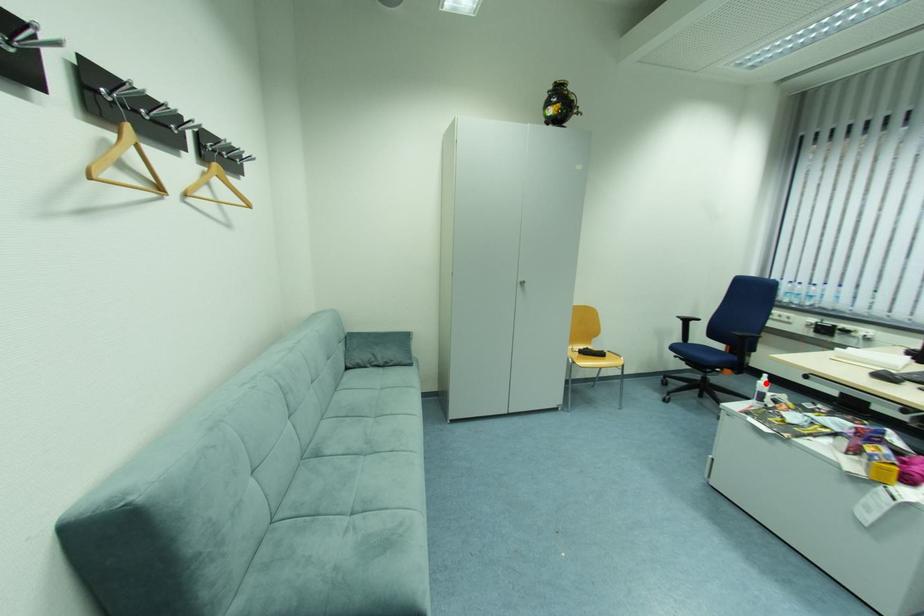
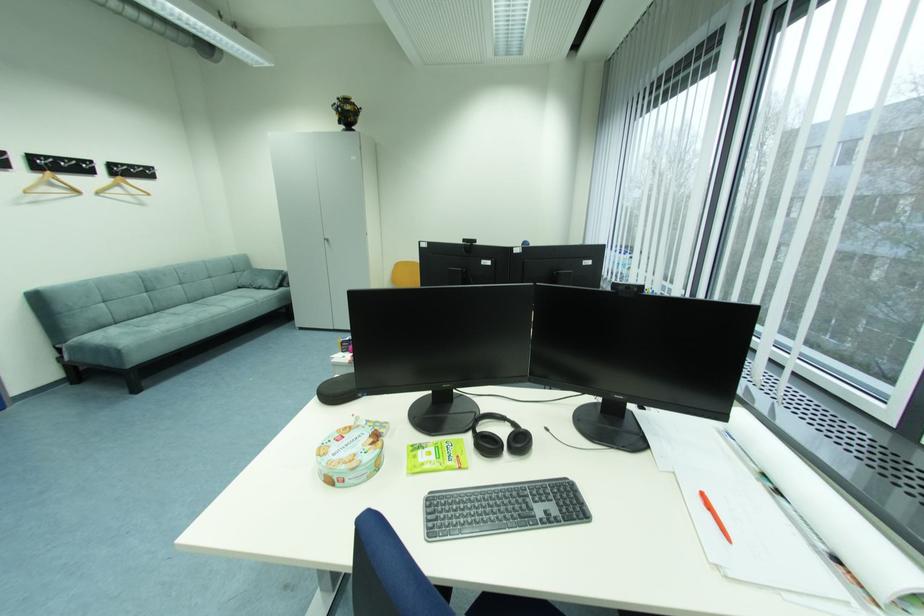
Question: I am providing you with two images of the same scene from different viewpoints. A red point is marked on the first image. Can you still see the location of the red point in image 2?

Choices:
 (A) Yes
 (B) No

Answer: (B)